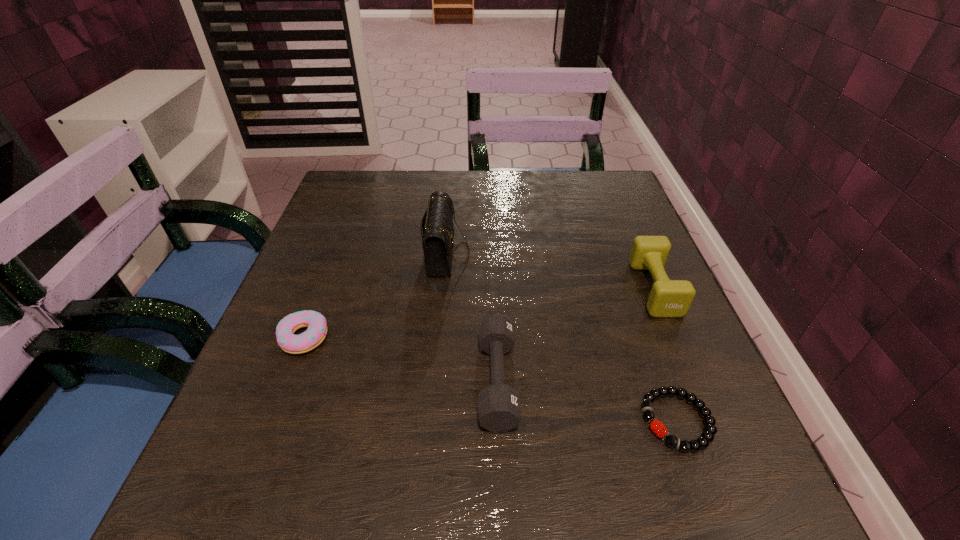
What are the coordinates of `vacant space at the far left corner` in the screenshot? It's located at (353, 203).

The width and height of the screenshot is (960, 540). I want to click on vacant space at the near left corner of the desktop, so click(276, 514).

At what (x,y) coordinates should I click in order to perform the action: click on blank space at the far right corner of the desktop. Please return your answer as a coordinate pair (x, y). The image size is (960, 540). Looking at the image, I should click on pyautogui.click(x=602, y=207).

Where is `empty space that is in between the fourth tallest object and the shorter dumbbell`? This screenshot has height=540, width=960. empty space that is in between the fourth tallest object and the shorter dumbbell is located at coordinates (400, 359).

Where is `free space that is in between the third object from left to right and the shortest object`? Image resolution: width=960 pixels, height=540 pixels. free space that is in between the third object from left to right and the shortest object is located at coordinates (587, 400).

Locate an element on the screen. This screenshot has width=960, height=540. free space between the shortest object and the shorter dumbbell is located at coordinates (587, 400).

I want to click on free space between the second object from left to right and the farther dumbbell, so click(x=550, y=271).

At what (x,y) coordinates should I click in order to perform the action: click on unoccupied position between the clutch bag and the right dumbbell. Please return your answer as a coordinate pair (x, y). The image size is (960, 540). Looking at the image, I should click on (550, 271).

Image resolution: width=960 pixels, height=540 pixels. Find the location of `free space between the bracelet and the shorter dumbbell`. free space between the bracelet and the shorter dumbbell is located at coordinates coord(587,400).

Where is `vacant point located between the farther dumbbell and the doughnut`? The height and width of the screenshot is (540, 960). vacant point located between the farther dumbbell and the doughnut is located at coordinates (479, 313).